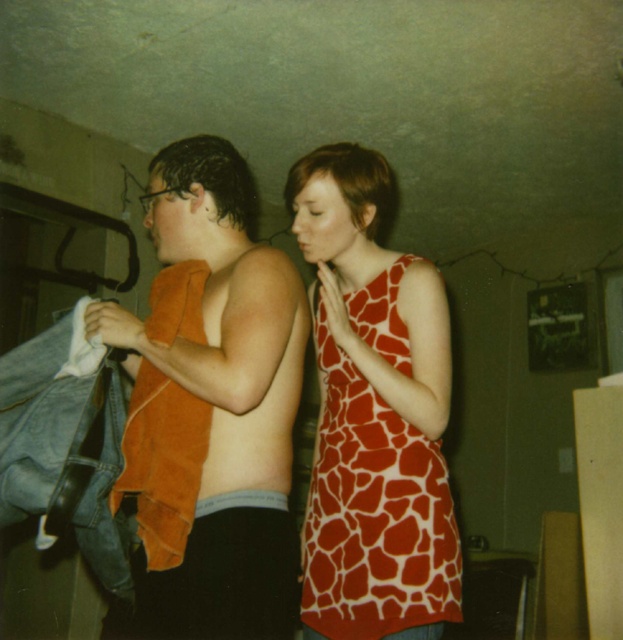
Does point (278, 353) lie in front of point (389, 561)?

Yes.

I want to click on orange towel at center, so click(221, 404).

This screenshot has width=623, height=640. Identify the location of orange towel at center. coord(221,404).

I want to click on orange towel at center, so click(x=221, y=404).